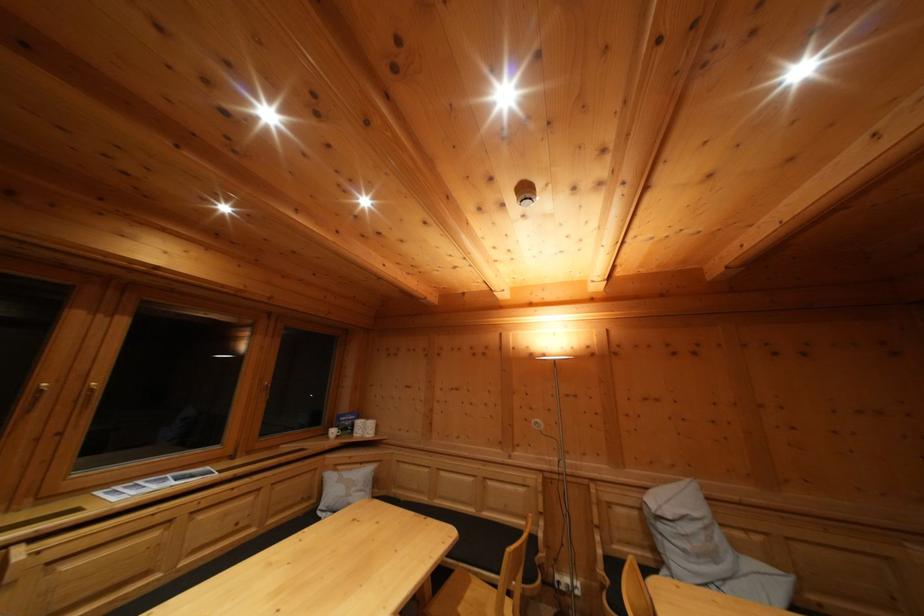
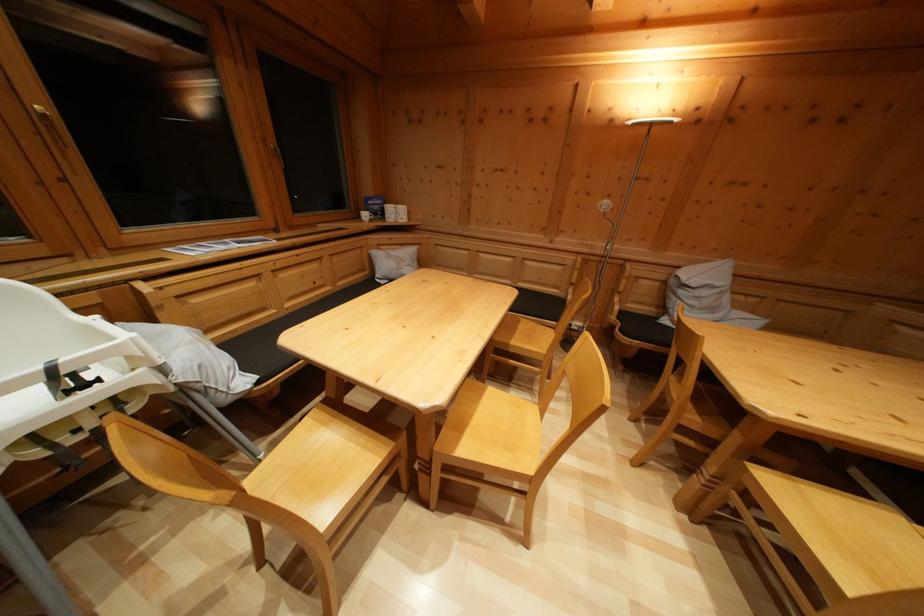
In the second image, find the point that corresponds to (x=613, y=565) in the first image.

(626, 318)